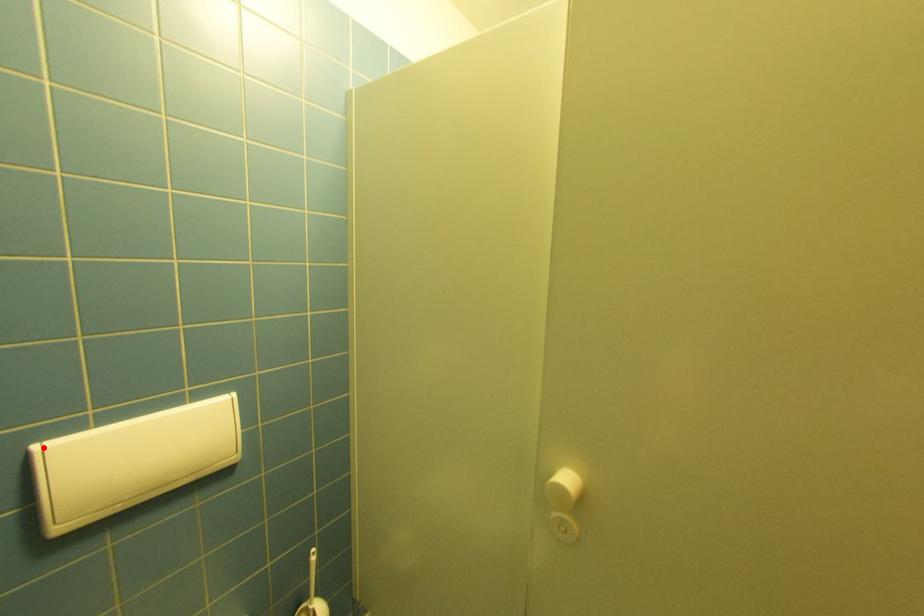
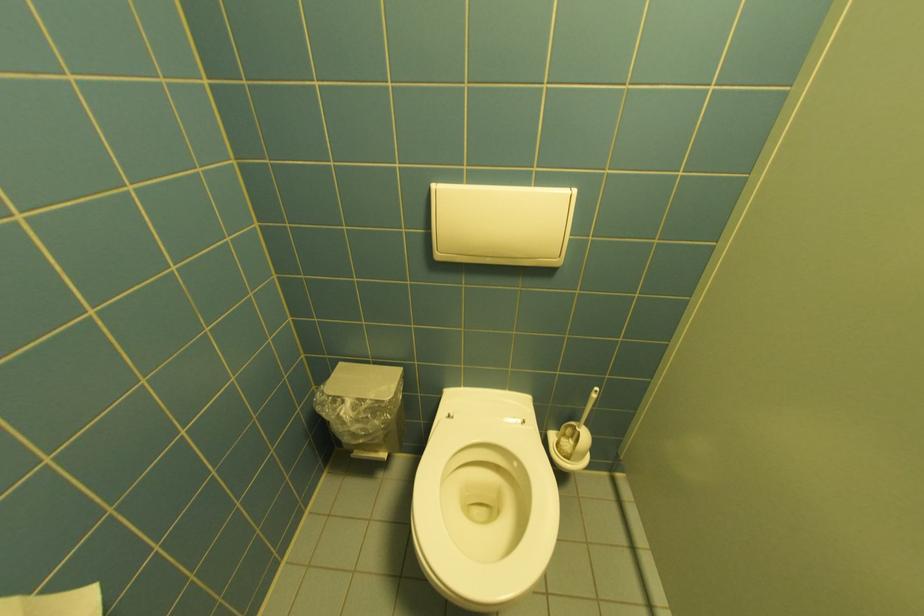
Where in the second image is the point corresponding to the highlighted location from the first image?

(440, 185)